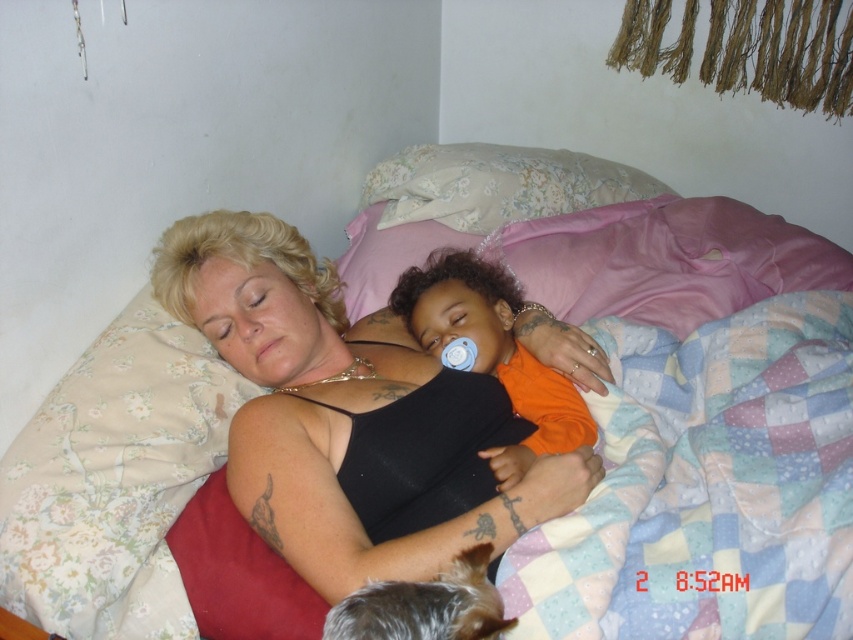
Question: Is floral fabric pillow at upper center smaller than shiny brown fur at lower center?

Choices:
 (A) no
 (B) yes

Answer: (A)

Question: Among these objects, which one is farthest from the camera?

Choices:
 (A) blue rubber teething ring at center
 (B) shiny brown fur at lower center

Answer: (A)

Question: Does floral fabric pillow at upper center appear on the left side of orange matte shirt at center?

Choices:
 (A) yes
 (B) no

Answer: (B)

Question: Which point is closer to the camera taking this photo?

Choices:
 (A) (422, 547)
 (B) (488, 232)
 (C) (438, 582)
 (D) (490, 285)

Answer: (C)

Question: Which of these objects is positioned farthest from the floral fabric pillow at upper center?

Choices:
 (A) black matte tank top at center
 (B) orange matte shirt at center
 (C) shiny brown fur at lower center

Answer: (C)

Question: Does black matte tank top at center appear on the right side of floral fabric pillow at upper center?

Choices:
 (A) no
 (B) yes

Answer: (A)